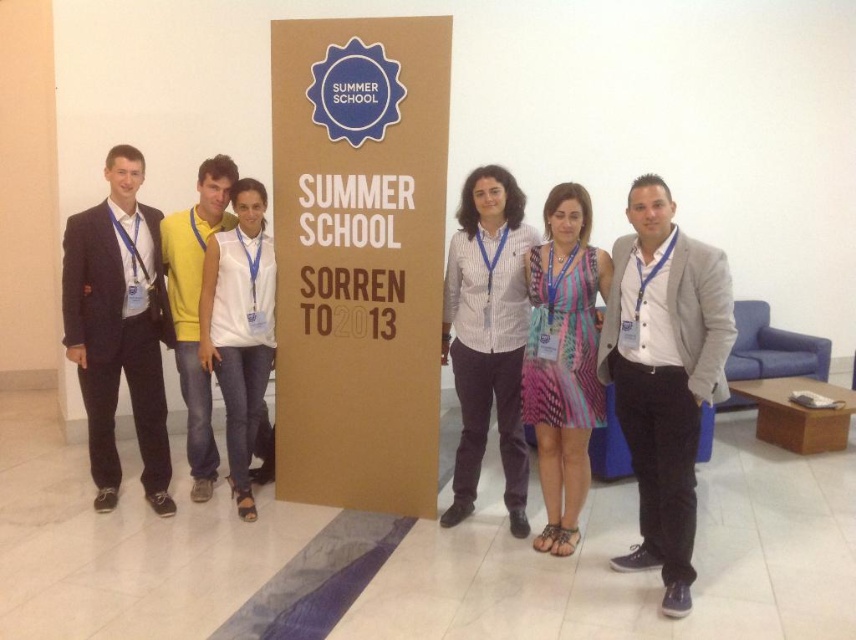
Is point (597, 292) positioned before point (242, 516)?

Yes, it is.

Which is behind, point (560, 256) or point (256, 250)?

Point (256, 250)

Does point (557, 483) lie behind point (230, 397)?

No, it is not.

The width and height of the screenshot is (856, 640). Find the location of `striped fabric dress at center`. striped fabric dress at center is located at coordinates (563, 358).

Can you confirm if white striped shirt at center is thinner than striped fabric dress at center?

No, white striped shirt at center is not thinner than striped fabric dress at center.

Consider the image. Does white striped shirt at center have a lesser height compared to striped fabric dress at center?

Incorrect, white striped shirt at center's height does not fall short of striped fabric dress at center's.

I want to click on white striped shirt at center, so click(x=486, y=336).

Find the location of a particular element. This screenshot has width=856, height=640. white striped shirt at center is located at coordinates (486, 336).

Which is behind, point (94, 480) or point (224, 333)?

The point (94, 480) is more distant.

Which is below, black suit at left or white matte shirt at center?

white matte shirt at center is lower down.

Locate an element on the screen. black suit at left is located at coordinates (119, 326).

The height and width of the screenshot is (640, 856). What are the coordinates of `black suit at left` in the screenshot? It's located at (119, 326).